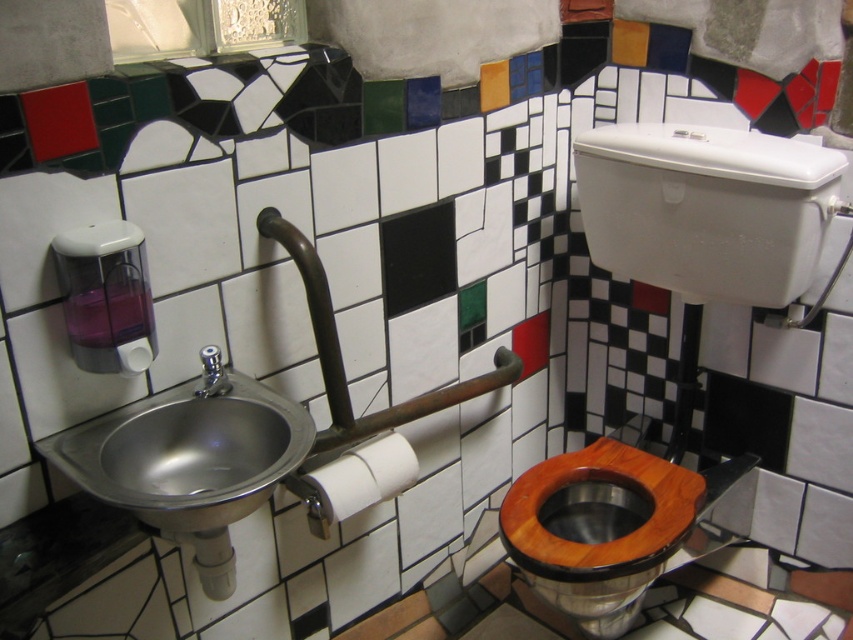
Question: Among these objects, which one is farthest from the camera?

Choices:
 (A) white matte toilet paper at center
 (B) white paper at sink left

Answer: (A)

Question: Which point is closer to the camera?

Choices:
 (A) satin nickel faucet at sink left
 (B) white paper at sink left
 (C) white matte toilet paper at center
 (D) metallic sink at left

Answer: (D)

Question: Which point is closer to the camera?

Choices:
 (A) white paper at sink left
 (B) wooden at center

Answer: (A)

Question: Is white matte toilet paper at center to the right of white paper at sink left from the viewer's perspective?

Choices:
 (A) yes
 (B) no

Answer: (A)

Question: Is satin nickel faucet at sink left below white paper at sink left?

Choices:
 (A) yes
 (B) no

Answer: (A)

Question: Is metallic sink at left positioned in front of white paper at sink left?

Choices:
 (A) yes
 (B) no

Answer: (A)